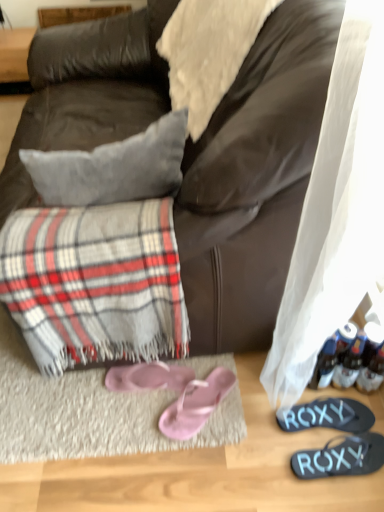
Question: Is pink satin flip-flops at lower center, which is the second footwear in left-to-right order, in contact with plaid fabric at lower left?

Choices:
 (A) no
 (B) yes

Answer: (A)

Question: Considering the relative sizes of pink satin flip-flops at lower center, which is the second footwear in left-to-right order, and plaid fabric at lower left in the image provided, is pink satin flip-flops at lower center, which is the second footwear in left-to-right order, thinner than plaid fabric at lower left?

Choices:
 (A) no
 (B) yes

Answer: (B)

Question: Does pink satin flip-flops at lower center, which is the 3th footwear in right-to-left order, turn towards plaid fabric at lower left?

Choices:
 (A) no
 (B) yes

Answer: (A)

Question: Does pink satin flip-flops at lower center, which is the 3th footwear in right-to-left order, come behind plaid fabric at lower left?

Choices:
 (A) no
 (B) yes

Answer: (B)

Question: Is pink satin flip-flops at lower center, which is the 3th footwear in right-to-left order, to the left of plaid fabric at lower left from the viewer's perspective?

Choices:
 (A) yes
 (B) no

Answer: (B)

Question: Would you say plaid fabric at lower left is part of pink satin flip-flops at lower center, which is the 3th footwear in right-to-left order,'s contents?

Choices:
 (A) yes
 (B) no

Answer: (B)

Question: From a real-world perspective, is dark brown leather couch at center beneath pink satin flip-flops at lower center, which is the 3th footwear in right-to-left order?

Choices:
 (A) no
 (B) yes

Answer: (A)

Question: Can you confirm if dark brown leather couch at center is bigger than pink satin flip-flops at lower center, which is the 3th footwear in right-to-left order?

Choices:
 (A) yes
 (B) no

Answer: (A)

Question: From the image's perspective, is dark brown leather couch at center located beneath pink satin flip-flops at lower center, which is the second footwear in left-to-right order?

Choices:
 (A) no
 (B) yes

Answer: (A)

Question: Can you confirm if dark brown leather couch at center is taller than pink satin flip-flops at lower center, which is the second footwear in left-to-right order?

Choices:
 (A) yes
 (B) no

Answer: (A)

Question: Is dark brown leather couch at center not close to pink satin flip-flops at lower center, which is the second footwear in left-to-right order?

Choices:
 (A) yes
 (B) no

Answer: (B)

Question: Is dark brown leather couch at center wider than pink satin flip-flops at lower center, which is the second footwear in left-to-right order?

Choices:
 (A) no
 (B) yes

Answer: (B)

Question: Are pink fabric flip-flops at lower center, which is counted as the 4th footwear, starting from the right, and pink satin flip-flops at lower center, which is the 3th footwear in right-to-left order, far apart?

Choices:
 (A) yes
 (B) no

Answer: (B)